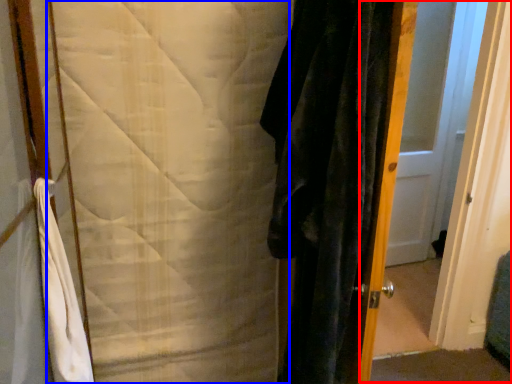
Question: Which object is closer to the camera taking this photo, screen door (highlighted by a red box) or blanket (highlighted by a blue box)?

Choices:
 (A) screen door
 (B) blanket

Answer: (B)